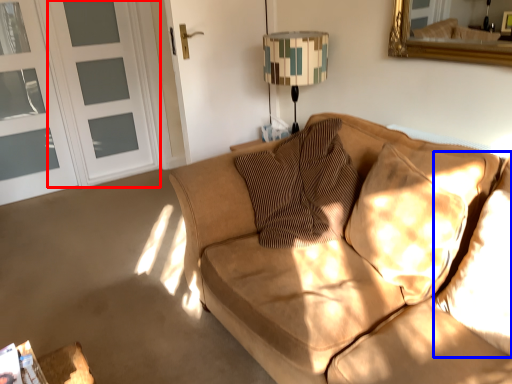
Question: Which point is further to the camera, screen door (highlighted by a red box) or pillow (highlighted by a blue box)?

Choices:
 (A) screen door
 (B) pillow

Answer: (A)